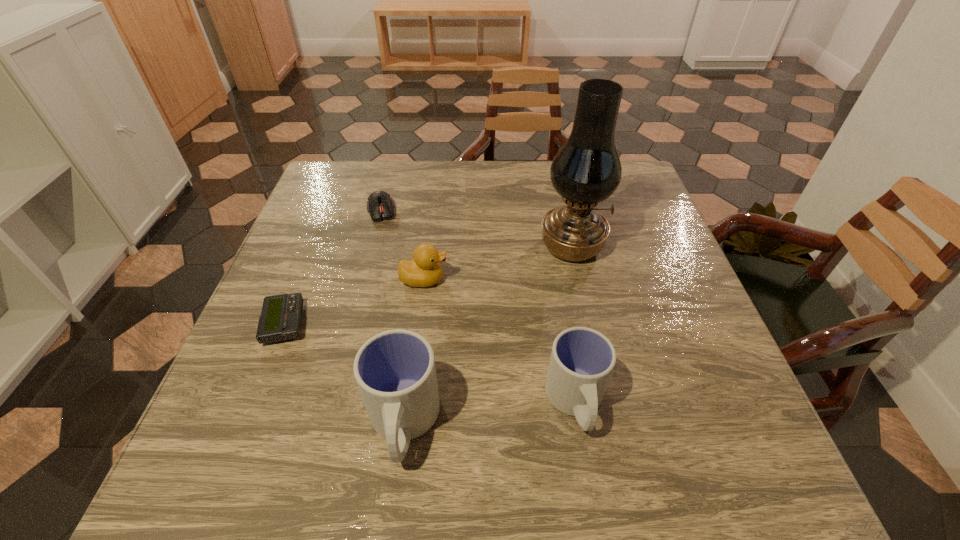
Identify the location of vacant point that satisfies the following two spatial constraints: 1. on the face of the third shortest object; 2. with the handle on the side of the taller cup. (405, 423).